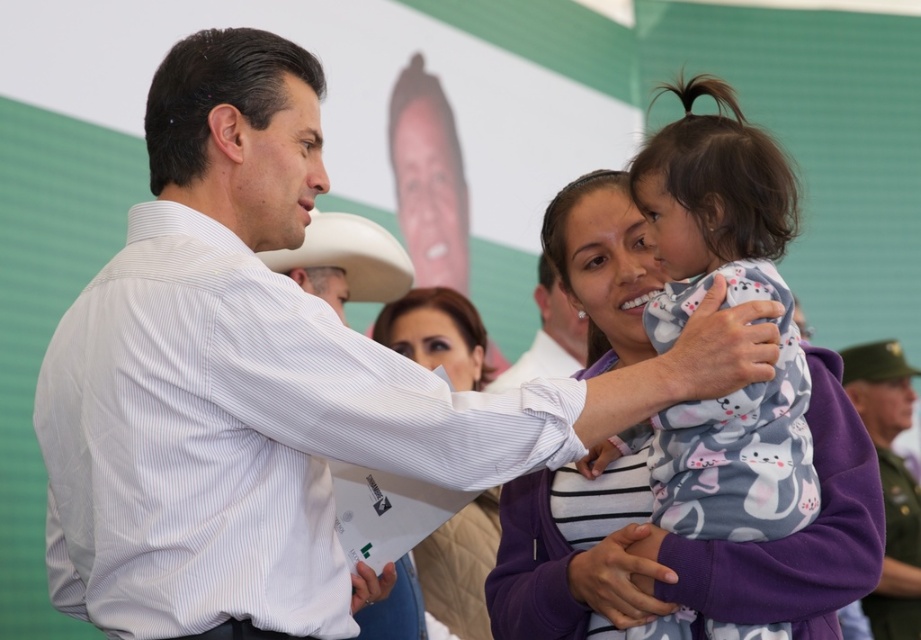
Between printed cotton onesie at center and purple fleece jacket at center, which one is positioned lower?

Positioned lower is purple fleece jacket at center.

What do you see at coordinates (727, 305) in the screenshot? I see `printed cotton onesie at center` at bounding box center [727, 305].

Measure the distance between point (659, 305) and camera.

Point (659, 305) is 8.34 feet from camera.

Where is `printed cotton onesie at center`? printed cotton onesie at center is located at coordinates (727, 305).

Is point (801, 362) positioned after point (336, 275)?

No, it is in front of (336, 275).

Who is positioned more to the right, printed cotton onesie at center or white matte cowboy hat at upper center?

printed cotton onesie at center

Measure the distance between point (780, 509) and camera.

A distance of 2.42 meters exists between point (780, 509) and camera.

Identify the location of printed cotton onesie at center. (727, 305).

Can you confirm if printed cotton onesie at center is positioned above smooth beige sweater at center?

No, printed cotton onesie at center is not above smooth beige sweater at center.

Does printed cotton onesie at center have a larger size compared to smooth beige sweater at center?

Correct, printed cotton onesie at center is larger in size than smooth beige sweater at center.

Is point (795, 444) more distant than point (478, 525)?

No, it is not.

The height and width of the screenshot is (640, 921). In order to click on printed cotton onesie at center in this screenshot , I will do click(727, 305).